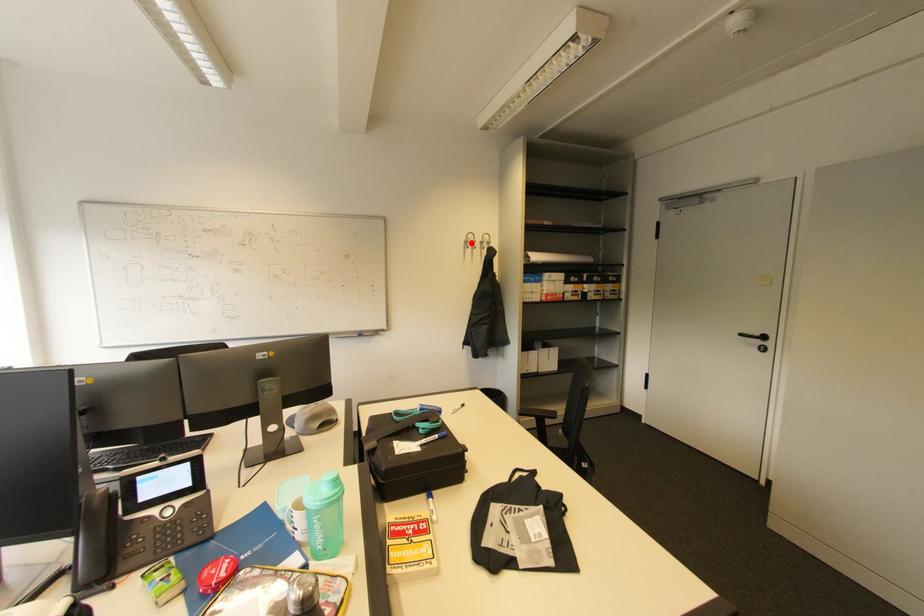
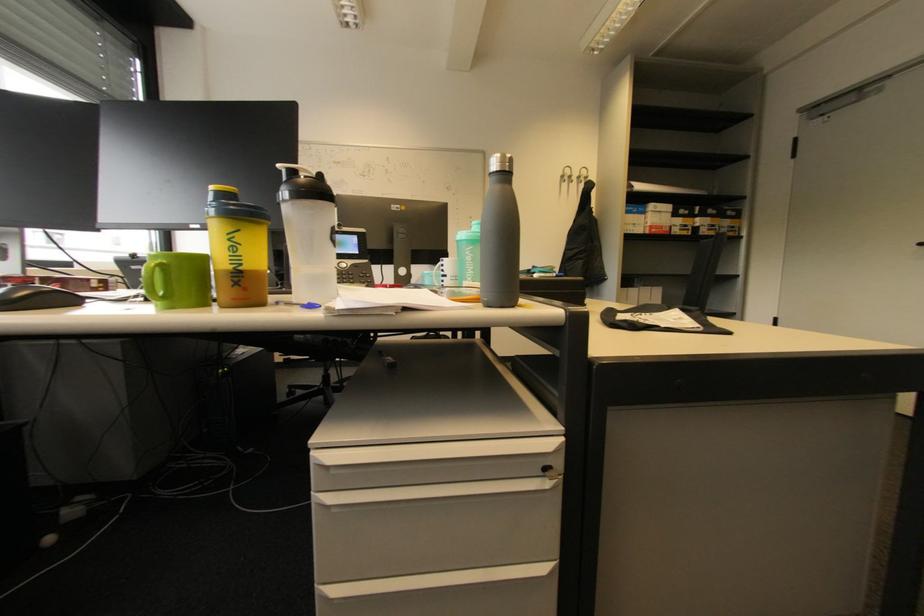
In the second image, find the point that corresponds to the highlighted location in the first image.

(567, 177)